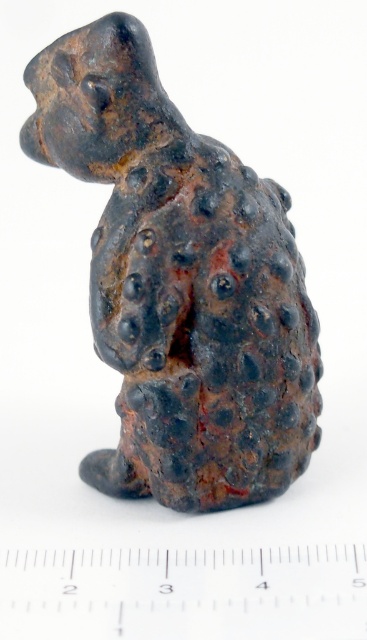
Who is higher up, rusty metal dog at center or white plastic ruler at center?

Positioned higher is rusty metal dog at center.

Who is more distant from viewer, [190,157] or [37,592]?

The point [190,157] is behind.

Is point (190, 499) behind point (176, 557)?

Yes, point (190, 499) is behind point (176, 557).

Identify the location of rusty metal dog at center. This screenshot has width=367, height=640. (180, 282).